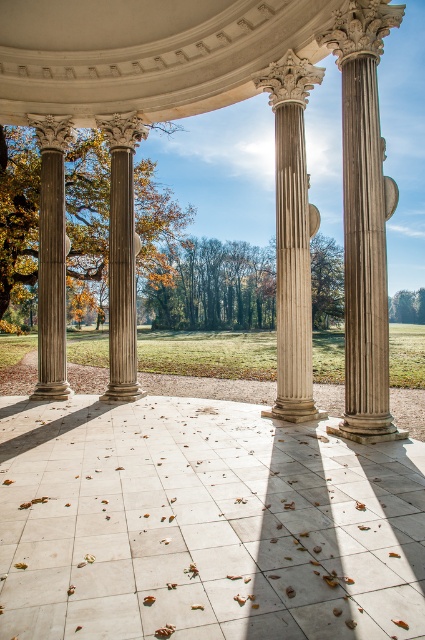
Can you confirm if smooth stone column at left is shorter than smooth gray column at center?

Incorrect, smooth stone column at left's height does not fall short of smooth gray column at center's.

Does smooth stone column at left appear on the right side of smooth gray column at center?

In fact, smooth stone column at left is to the left of smooth gray column at center.

Is point (39, 124) behind point (127, 356)?

Yes, it is.

This screenshot has width=425, height=640. Find the location of `smooth stone column at left`. smooth stone column at left is located at coordinates (51, 257).

Does point (167, 195) come in front of point (62, 365)?

No, (167, 195) is behind (62, 365).

Who is positioned more to the left, autumn leaves at left or smooth stone column at left?

From the viewer's perspective, autumn leaves at left appears more on the left side.

Which is behind, point (19, 125) or point (42, 381)?

Point (19, 125)

Locate an element on the screen. autumn leaves at left is located at coordinates (17, 214).

Which of these two, smooth gray column at center or green leafy tree at center, stands shorter?

Standing shorter between the two is smooth gray column at center.

Is smooth gray column at center shorter than green leafy tree at center?

Indeed, smooth gray column at center has a lesser height compared to green leafy tree at center.

This screenshot has height=640, width=425. Describe the element at coordinates (121, 257) in the screenshot. I see `smooth gray column at center` at that location.

What are the coordinates of `smooth gray column at center` in the screenshot? It's located at (121, 257).